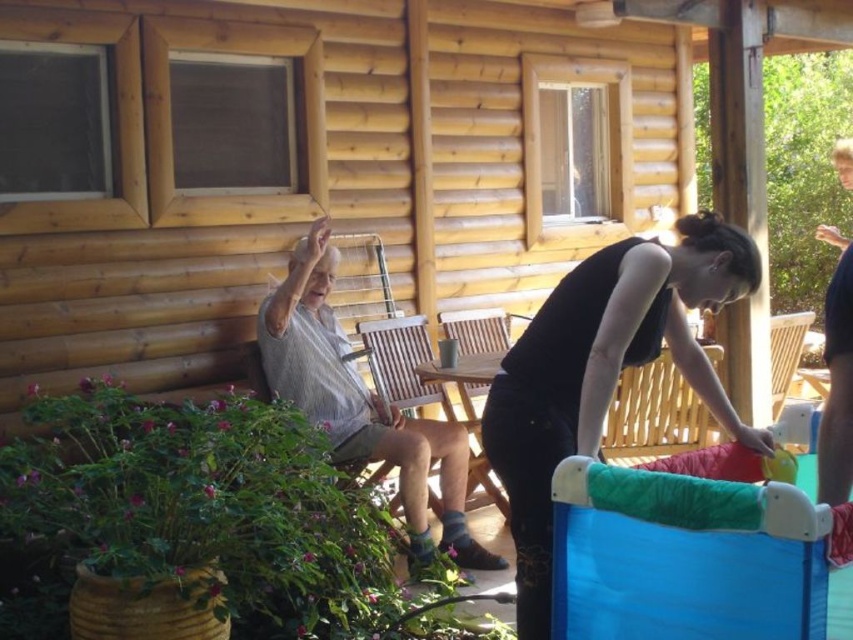
Identify the location of black matte tank top at center. The height and width of the screenshot is (640, 853). (602, 372).

Does black matte tank top at center have a smaller size compared to light gray striped shirt at left?

Yes.

This screenshot has height=640, width=853. I want to click on black matte tank top at center, so click(602, 372).

At what (x,y) coordinates should I click in order to perform the action: click on black matte tank top at center. Please return your answer as a coordinate pair (x, y). This screenshot has height=640, width=853. Looking at the image, I should click on (602, 372).